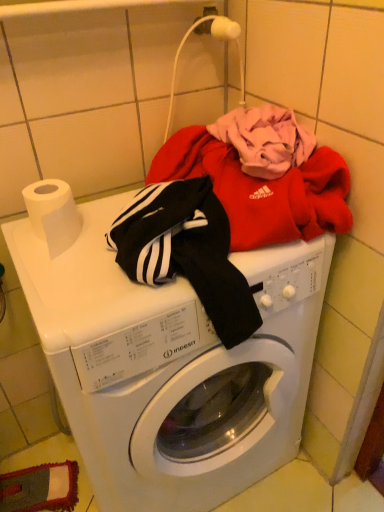
I want to click on white matte toilet paper at left, so click(53, 214).

The width and height of the screenshot is (384, 512). What do you see at coordinates (53, 214) in the screenshot?
I see `white matte toilet paper at left` at bounding box center [53, 214].

In order to face white glossy washing machine at center, should I rotate leftwards or rightwards?

You should rotate left by 2.968 degrees.

What do you see at coordinates (171, 366) in the screenshot? I see `white glossy washing machine at center` at bounding box center [171, 366].

What is the approximate width of white glossy washing machine at center?

The width of white glossy washing machine at center is 20.22 inches.

Locate an element on the screen. The height and width of the screenshot is (512, 384). white glossy washing machine at center is located at coordinates [171, 366].

Identify the location of white matte toilet paper at left. (53, 214).

Which is more to the left, white matte toilet paper at left or white glossy washing machine at center?

Positioned to the left is white matte toilet paper at left.

Relative to white glossy washing machine at center, is white matte toilet paper at left in front or behind?

Clearly, white matte toilet paper at left is behind white glossy washing machine at center.

Is point (52, 204) farther from camera compared to point (241, 373)?

No, it is not.

From the image's perspective, is white matte toilet paper at left located above or below white glossy washing machine at center?

white matte toilet paper at left is above white glossy washing machine at center.

From a real-world perspective, is white matte toilet paper at left on white glossy washing machine at center?

Yes, from a real-world perspective, white matte toilet paper at left is above white glossy washing machine at center.

Considering the relative sizes of white matte toilet paper at left and white glossy washing machine at center in the image provided, is white matte toilet paper at left thinner than white glossy washing machine at center?

Correct, the width of white matte toilet paper at left is less than that of white glossy washing machine at center.

Between white matte toilet paper at left and white glossy washing machine at center, which one has less height?

white matte toilet paper at left is shorter.

Between white matte toilet paper at left and white glossy washing machine at center, which one has smaller size?

Smaller between the two is white matte toilet paper at left.

Is white matte toilet paper at left not within white glossy washing machine at center?

Yes, white matte toilet paper at left is located beyond the bounds of white glossy washing machine at center.

Is white matte toilet paper at left next to white glossy washing machine at center?

No.

Is white matte toilet paper at left looking in the opposite direction of white glossy washing machine at center?

No, white matte toilet paper at left's orientation is not away from white glossy washing machine at center.

What's the angular difference between white matte toilet paper at left and white glossy washing machine at center's facing directions?

3.68e-05 degrees.

Measure the distance between white matte toilet paper at left and white glossy washing machine at center.

They are 14.37 inches apart.

Image resolution: width=384 pixels, height=512 pixels. I want to click on toilet paper on the left of the white glossy washing machine at center, so click(53, 214).

Is white glossy washing machine at center to the right of white matte toilet paper at left from the viewer's perspective?

Indeed, white glossy washing machine at center is positioned on the right side of white matte toilet paper at left.

Which object is further away from the camera, white glossy washing machine at center or white matte toilet paper at left?

white matte toilet paper at left is behind.

Which is closer to the camera, (164,335) or (48,233)?

Positioned in front is point (164,335).

From the image's perspective, between white glossy washing machine at center and white matte toilet paper at left, who is located below?

white glossy washing machine at center is shown below in the image.

In the scene shown: From a real-world perspective, is white glossy washing machine at center physically located above or below white matte toilet paper at left?

white glossy washing machine at center is below white matte toilet paper at left.

Does white glossy washing machine at center have a greater width compared to white matte toilet paper at left?

Indeed, white glossy washing machine at center has a greater width compared to white matte toilet paper at left.

Does white glossy washing machine at center have a greater height compared to white matte toilet paper at left?

Correct, white glossy washing machine at center is much taller as white matte toilet paper at left.

Considering the relative sizes of white glossy washing machine at center and white matte toilet paper at left in the image provided, is white glossy washing machine at center smaller than white matte toilet paper at left?

No.

Would you say white glossy washing machine at center is inside or outside white matte toilet paper at left?

white glossy washing machine at center lies outside white matte toilet paper at left.

Are white glossy washing machine at center and white matte toilet paper at left located far from each other?

They are positioned close to each other.

Is white glossy washing machine at center aimed at white matte toilet paper at left?

No, white glossy washing machine at center is not oriented towards white matte toilet paper at left.

Looking at this image, measure the distance between white glossy washing machine at center and white matte toilet paper at left.

They are 14.37 inches apart.

The width and height of the screenshot is (384, 512). Identify the location of washing machine in front of the white matte toilet paper at left. (171, 366).

Identify the location of toilet paper that appears behind the white glossy washing machine at center. (53, 214).

Where is `washing machine below the white matte toilet paper at left (from the image's perspective)`? washing machine below the white matte toilet paper at left (from the image's perspective) is located at coordinates (171, 366).